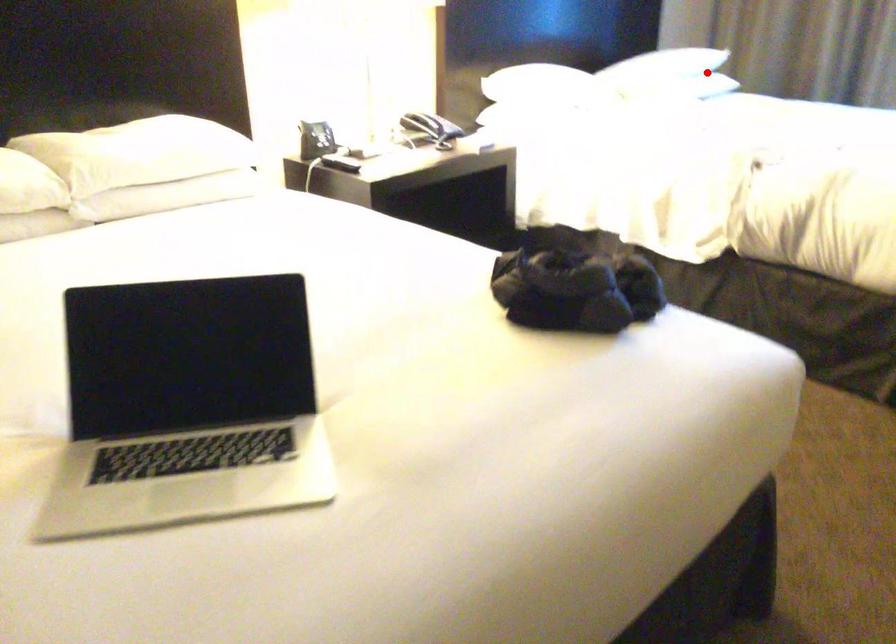
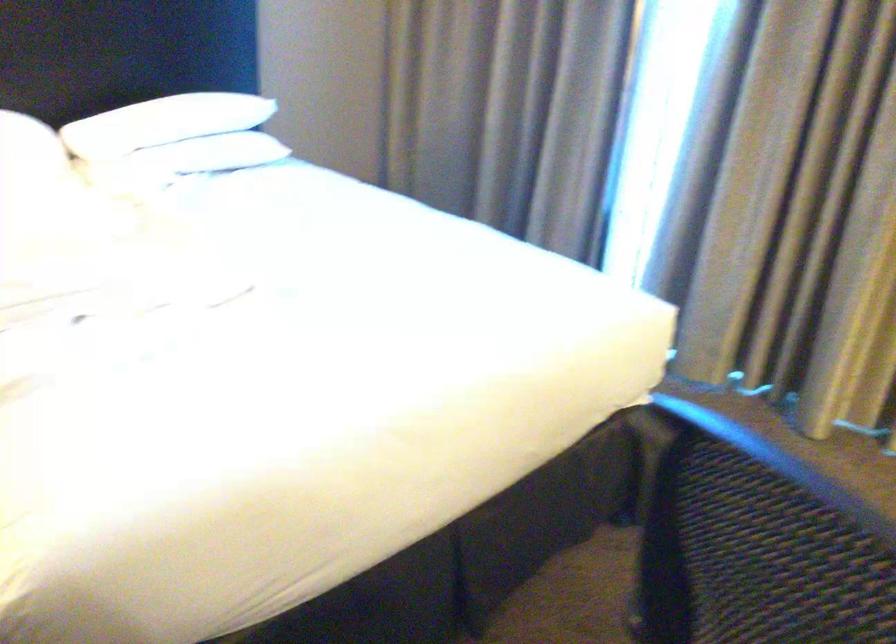
Question: I am providing you with two images of the same scene from different viewpoints. Image1 has a red point marked. In image2, the corresponding 3D location appears at what relative position? Reply with the corresponding letter.

Choices:
 (A) Closer
 (B) Farther

Answer: (A)